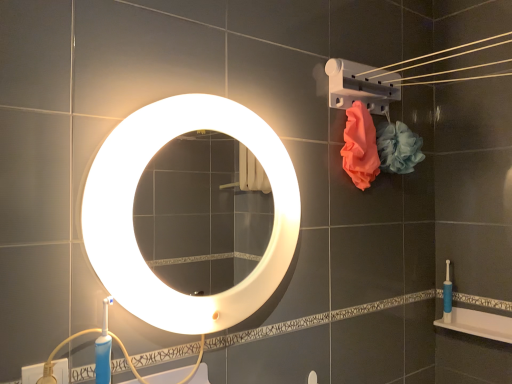
Question: Is white glossy mirror at center bigger or smaller than matte orange towel at upper right, placed as the 1th flower when sorted from left to right?

Choices:
 (A) small
 (B) big

Answer: (B)

Question: From the image's perspective, is white glossy mirror at center positioned above or below matte orange towel at upper right, which ranks as the 2th flower in right-to-left order?

Choices:
 (A) below
 (B) above

Answer: (A)

Question: Considering the real-world distances, which object is farthest from the white glossy mirror at center?

Choices:
 (A) blue rubber toilet brush at right
 (B) white glossy bath at lower right
 (C) soft pink mesh sponge at upper right, positioned as the 2th flower in left-to-right order
 (D) matte orange towel at upper right, placed as the 1th flower when sorted from left to right

Answer: (B)

Question: Which is farther from the blue rubber toilet brush at right?

Choices:
 (A) white glossy bath at lower right
 (B) matte orange towel at upper right, which ranks as the 2th flower in right-to-left order
 (C) white glossy mirror at center
 (D) soft pink mesh sponge at upper right, which ranks as the first flower in right-to-left order

Answer: (C)